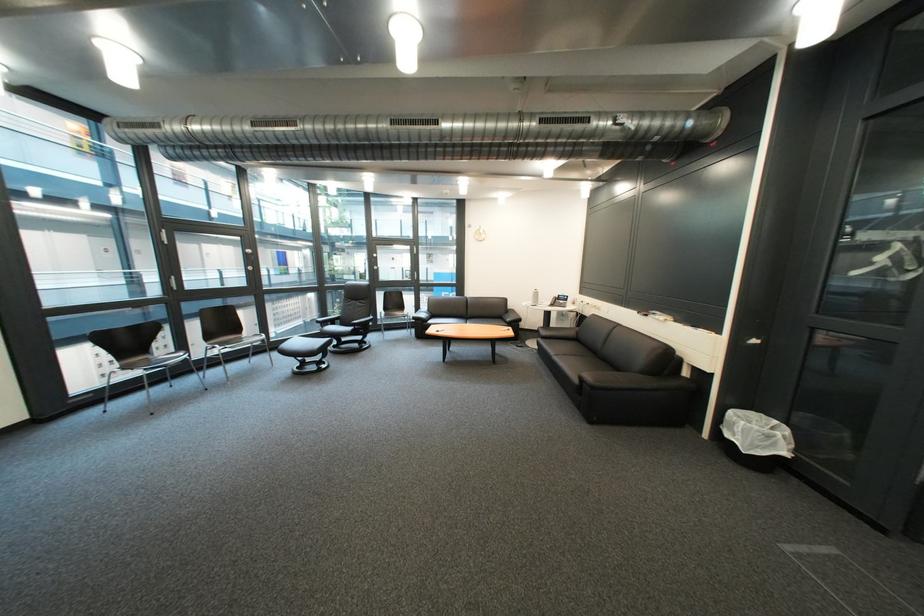
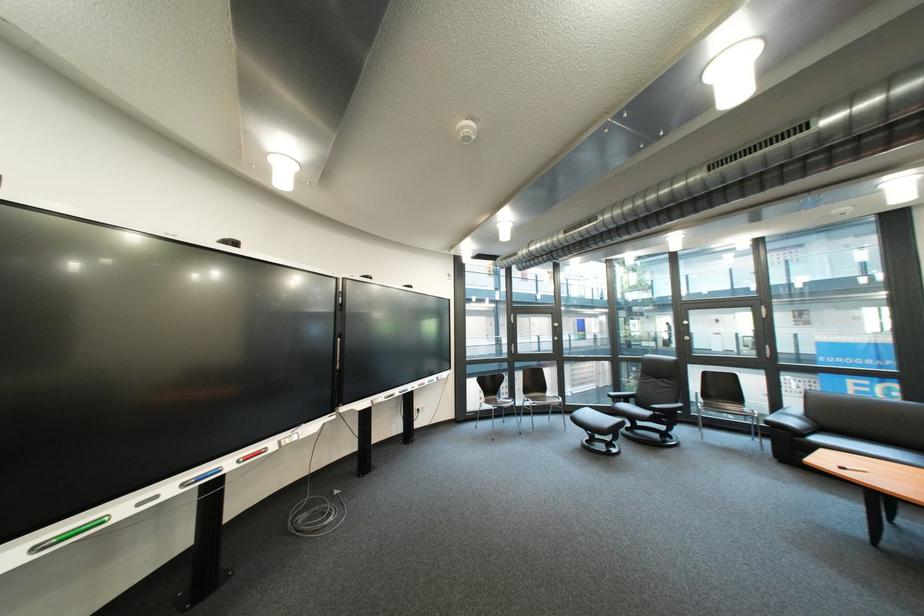
Where in the second image is the point corresponding to the point at 362,330 from the first image?

(661, 415)